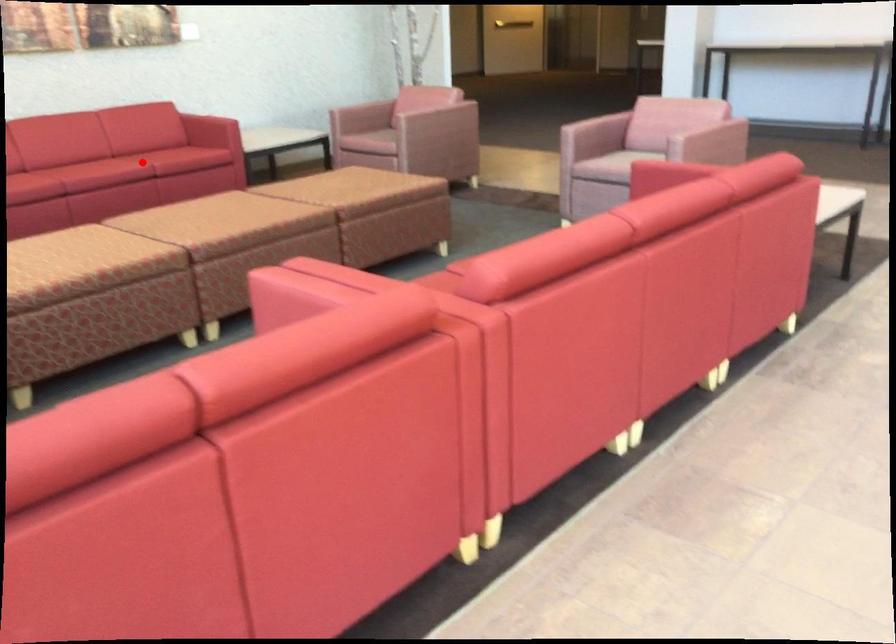
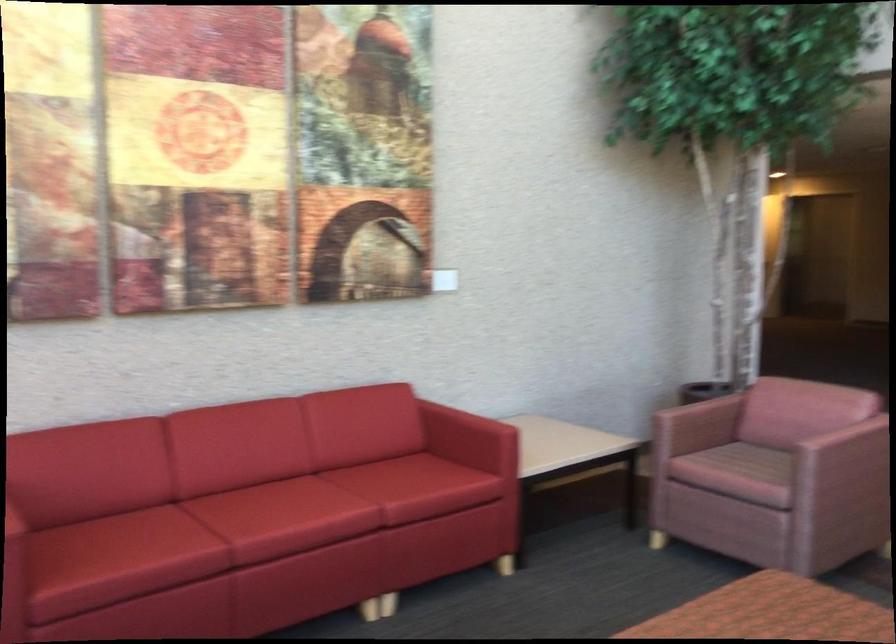
In the second image, find the point that corresponds to the highlighted location in the first image.

(363, 533)